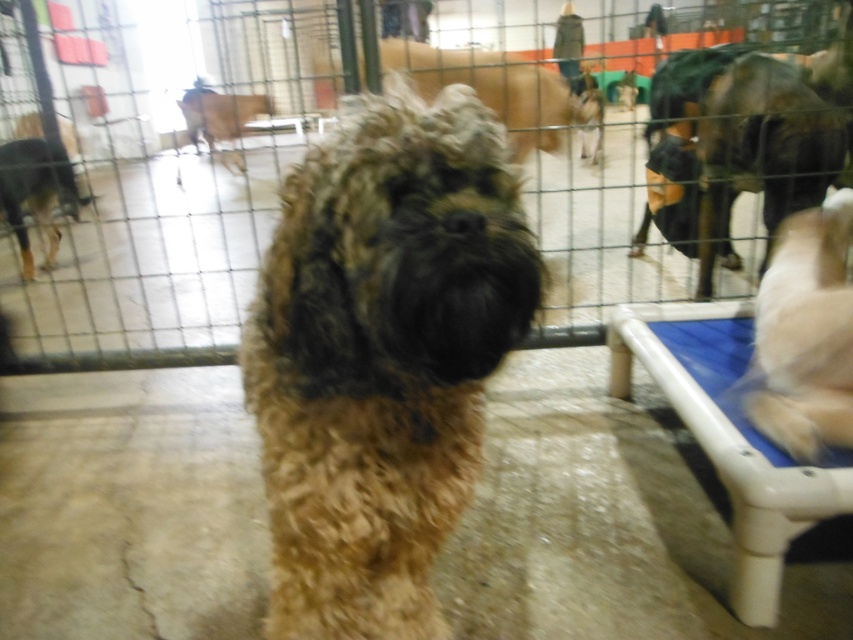
Can you confirm if metal wire fence at center is thinner than black fur dog at left?

No.

Find the location of a particular element. metal wire fence at center is located at coordinates pos(329,128).

Between metal wire fence at center and fuzzy brown dog at center, which one appears on the right side from the viewer's perspective?

From the viewer's perspective, metal wire fence at center appears more on the right side.

Does metal wire fence at center have a greater height compared to fuzzy brown dog at center?

Yes.

Between point (67, 259) and point (271, 243), which one is positioned in front?

Point (271, 243) is more forward.

You are a GUI agent. You are given a task and a screenshot of the screen. Output one action in this format:
    pyautogui.click(x=<x>, y=<y>)
    Task: Click on the metal wire fence at center
    
    Given the screenshot: What is the action you would take?
    (329, 128)

Who is higher up, fuzzy brown dog at center or white fluffy dog at right?

white fluffy dog at right is above.

Between point (303, 477) and point (792, 454), which one is positioned in front?

Point (303, 477)

The height and width of the screenshot is (640, 853). What are the coordinates of `fuzzy brown dog at center` in the screenshot? It's located at (381, 355).

Locate an element on the screen. fuzzy brown dog at center is located at coordinates (381, 355).